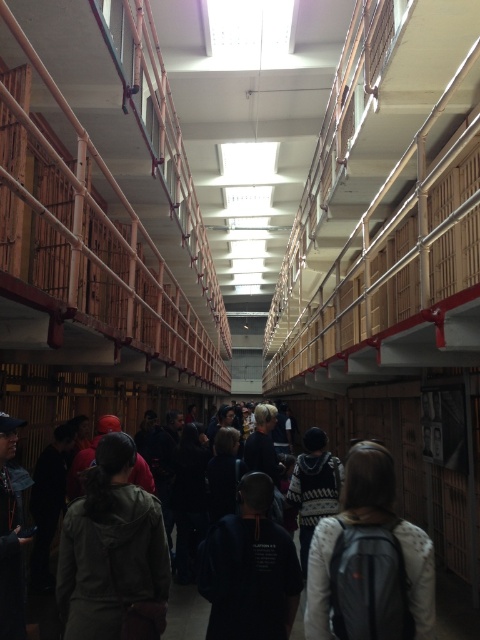
Who is more distant from viewer, [370,552] or [14,560]?

Positioned behind is point [14,560].

Is point (392, 468) farther from camera compared to point (4, 540)?

No, (392, 468) is in front of (4, 540).

Is point (343, 516) farther from camera compared to point (6, 628)?

No, it is not.

Find the location of `white sweater at center`. white sweater at center is located at coordinates click(x=370, y=561).

Is black matte sweatshirt at center bigger than dark gray hoodie at center?

Yes, black matte sweatshirt at center is bigger than dark gray hoodie at center.

You are a GUI agent. You are given a task and a screenshot of the screen. Output one action in this format:
    pyautogui.click(x=<x>, y=<y>)
    Task: Click on the black matte sweatshirt at center
    
    Given the screenshot: What is the action you would take?
    pyautogui.click(x=250, y=570)

Can you confirm if green matte jacket at center is thinner than dark gray hoodie at center?

Incorrect, green matte jacket at center's width is not less than dark gray hoodie at center's.

Can you confirm if green matte jacket at center is wider than dark gray hoodie at center?

Indeed, green matte jacket at center has a greater width compared to dark gray hoodie at center.

Describe the element at coordinates (112, 554) in the screenshot. I see `green matte jacket at center` at that location.

Locate an element on the screen. The height and width of the screenshot is (640, 480). green matte jacket at center is located at coordinates (112, 554).